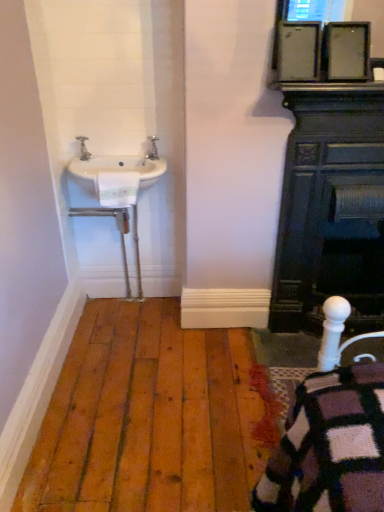
Where is `vacant area situated to the left side of polished brass faucet at upper left, the 1th tap in the right-to-left sequence`? The width and height of the screenshot is (384, 512). vacant area situated to the left side of polished brass faucet at upper left, the 1th tap in the right-to-left sequence is located at coordinates (131, 154).